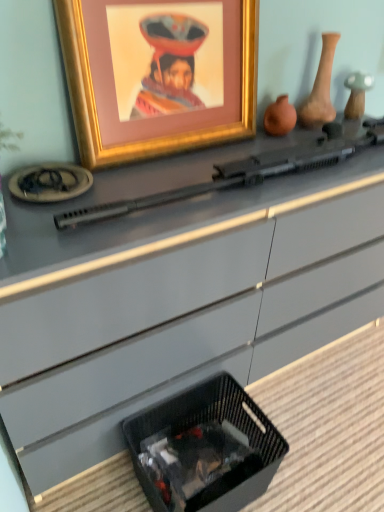
This screenshot has height=512, width=384. In order to click on free point in front of matte clay vase at upper right, placed as the second vase when sorted from left to right in this screenshot , I will do `click(315, 138)`.